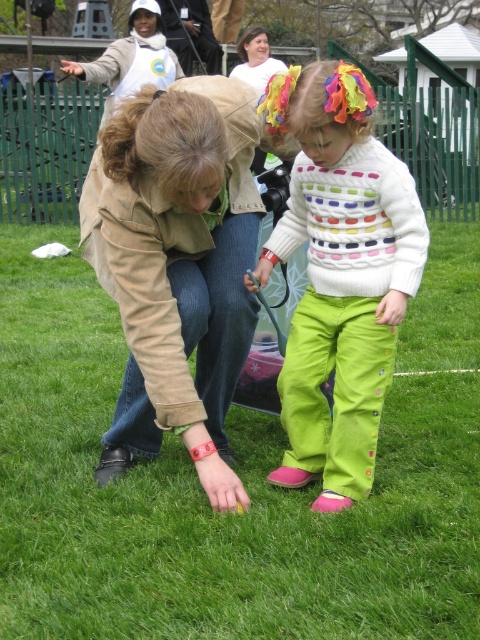
You are a hiker who has just arrived at the scene shown in the image. You need to locate the white cotton shirt at upper center. According to the coordinates provided, where should you look to find it?

The white cotton shirt at upper center is located at point coordinates of [132,58].

You are a person who is 5 feet tall. You are standing on the green grass at center and want to reach the matte beige jacket at center. Can you jump and grab it from your current position?

The distance between the green grass at center and the matte beige jacket at center is 24.63 feet. Since the average jump distance for a 5 feet tall person is about 4 to 5 feet, you cannot jump and grab the matte beige jacket at center from the green grass at center.

You are a photographer trying to capture a candid shot of the two people in the scene. You notice the white cotton shirt at upper center and the matte beige jacket at center. Which clothing item should you focus on if you want to highlight something larger in the image?

The white cotton shirt at upper center is bigger than the matte beige jacket at center, so focusing on the white cotton shirt at upper center would highlight the larger clothing item in the image.